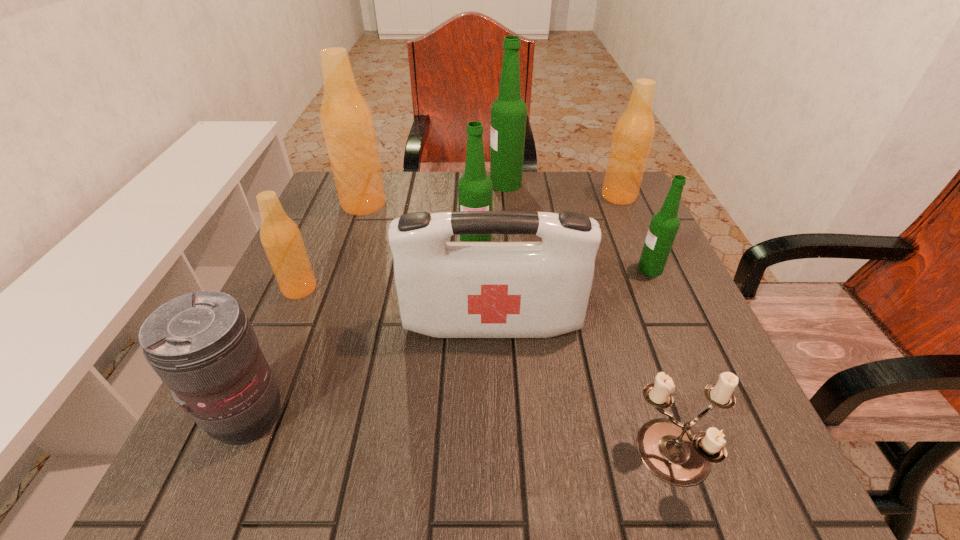
I want to click on the farthest green beer bottle, so click(x=508, y=112).

What are the coordinates of `the fourth beer bottle from left to right` in the screenshot? It's located at (508, 112).

Find the location of a particular element. This screenshot has height=540, width=960. the biggest tan beer bottle is located at coordinates (347, 123).

Find the location of `the rightmost tan beer bottle`. the rightmost tan beer bottle is located at coordinates (633, 134).

The height and width of the screenshot is (540, 960). Identify the location of the leftmost green beer bottle. (475, 189).

At what (x,y) coordinates should I click in order to perform the action: click on the sixth nearest object. Please return your answer as a coordinate pair (x, y). Image resolution: width=960 pixels, height=540 pixels. Looking at the image, I should click on (475, 189).

This screenshot has height=540, width=960. I want to click on the third nearest object, so click(445, 289).

Identify the location of red first-aid kit. This screenshot has width=960, height=540. (445, 289).

You are a GUI agent. You are given a task and a screenshot of the screen. Output one action in this format:
    pyautogui.click(x=<x>, y=<y>)
    Task: Click on the nearest green beer bottle
    
    Given the screenshot: What is the action you would take?
    pyautogui.click(x=664, y=225)

Locate an element on the screen. the smallest green beer bottle is located at coordinates (664, 225).